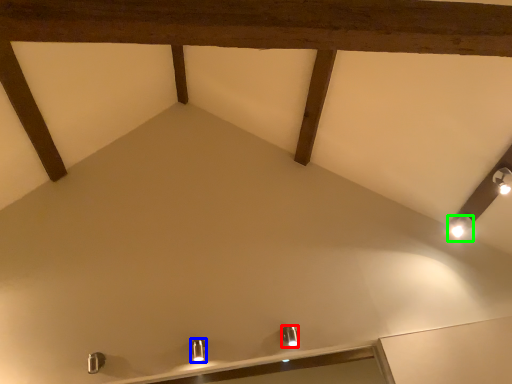
Question: Considering the real-world distances, which object is closest to light fixture (highlighted by a red box)? light fixture (highlighted by a blue box) or light fixture (highlighted by a green box).

Choices:
 (A) light fixture
 (B) light fixture

Answer: (A)